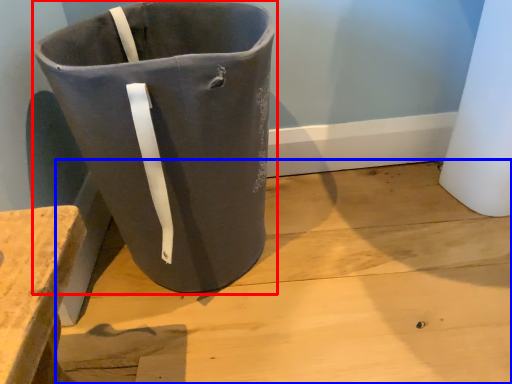
Question: Which of the following is the farthest to the observer, waste container (highlighted by a red box) or concrete (highlighted by a blue box)?

Choices:
 (A) waste container
 (B) concrete

Answer: (B)